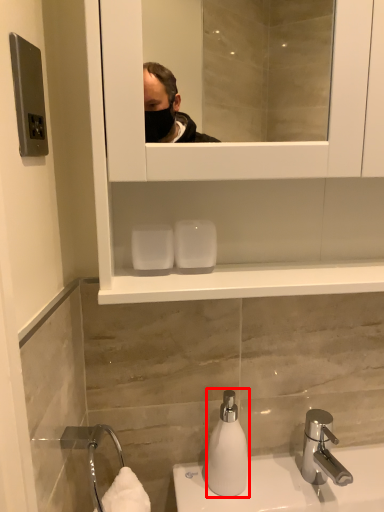
Question: From the image, what is the correct spatial relationship of soap dispenser (annotated by the red box) in relation to tap?

Choices:
 (A) right
 (B) left

Answer: (B)